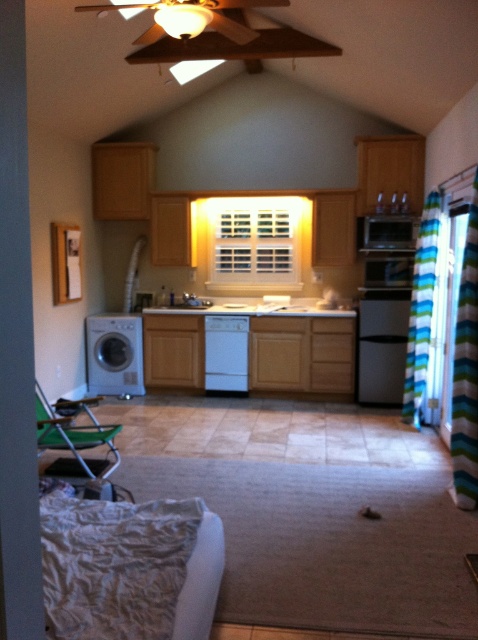
Question: Can you confirm if satin silver microwave at upper center is smaller than white glossy sink at center?

Choices:
 (A) yes
 (B) no

Answer: (A)

Question: Is black matte refrigerator at right positioned behind white glossy sink at center?

Choices:
 (A) yes
 (B) no

Answer: (B)

Question: Which point is closer to the camera taking this photo?

Choices:
 (A) (390, 230)
 (B) (361, 248)
 (C) (125, 348)

Answer: (A)

Question: Which of the following is the closest to the observer?

Choices:
 (A) black matte refrigerator at right
 (B) white matte dishwasher at center
 (C) white matte washer at left
 (D) satin silver microwave at upper center

Answer: (A)

Question: Which of the following is the farthest from the observer?

Choices:
 (A) (364, 230)
 (B) (404, 218)
 (C) (184, 294)

Answer: (C)

Question: Is white matte washer at left smaller than white matte dishwasher at center?

Choices:
 (A) yes
 (B) no

Answer: (B)